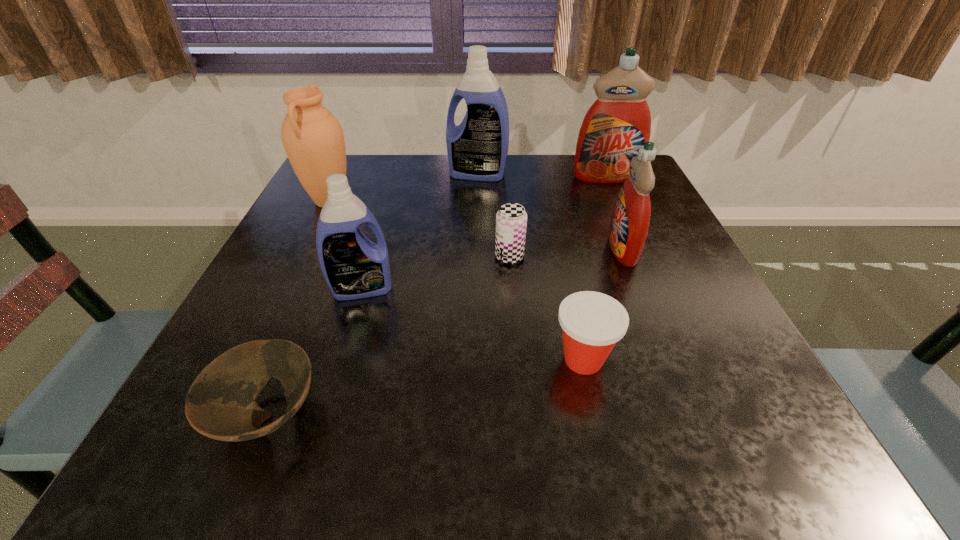
Locate an element on the screen. The height and width of the screenshot is (540, 960). free space located 0.250m on the left of the purple beer can is located at coordinates (369, 256).

The width and height of the screenshot is (960, 540). I want to click on vacant region located on the back of the red-orange Dixie cup, so click(564, 276).

Locate an element on the screen. The image size is (960, 540). free space located on the right of the bowl is located at coordinates (358, 416).

This screenshot has height=540, width=960. What are the coordinates of `urn that is at the far edge` in the screenshot? It's located at (313, 139).

The width and height of the screenshot is (960, 540). In order to click on object present at the near edge in this screenshot , I will do `click(221, 404)`.

This screenshot has height=540, width=960. Find the location of `urn located at the left edge`. urn located at the left edge is located at coordinates (313, 139).

Where is `detergent at the left edge`? The image size is (960, 540). detergent at the left edge is located at coordinates (354, 267).

Identify the location of bowl present at the left edge. (221, 404).

Locate an element on the screen. object situated at the far left corner is located at coordinates (313, 139).

This screenshot has width=960, height=540. What are the coordinates of `object located in the near left corner section of the desktop` in the screenshot? It's located at (221, 404).